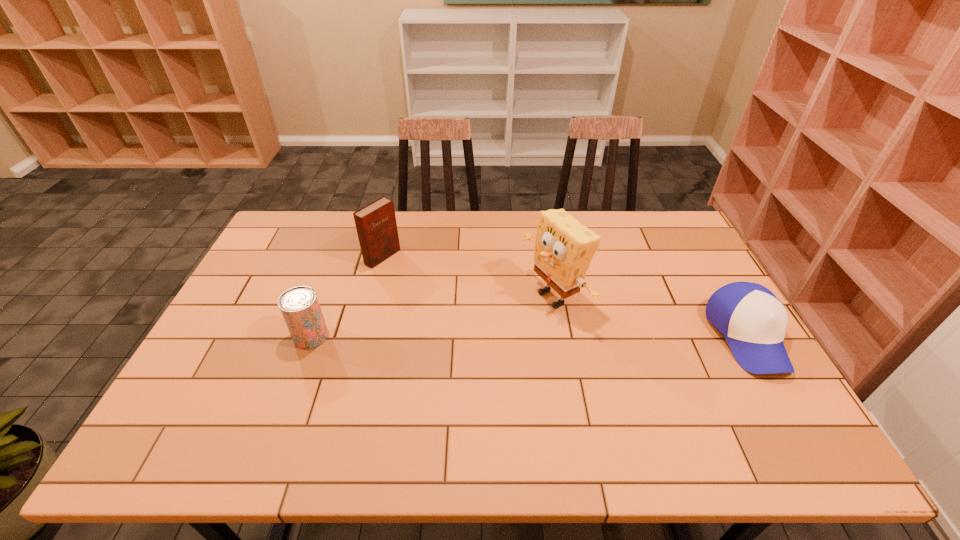
The height and width of the screenshot is (540, 960). What are the coordinates of `object that can be found as the third closest to the leftmost object` in the screenshot? It's located at (753, 320).

The image size is (960, 540). I want to click on free space that satisfies the following two spatial constraints: 1. on the front side of the second object from left to right; 2. on the left side of the sponge, so click(x=372, y=298).